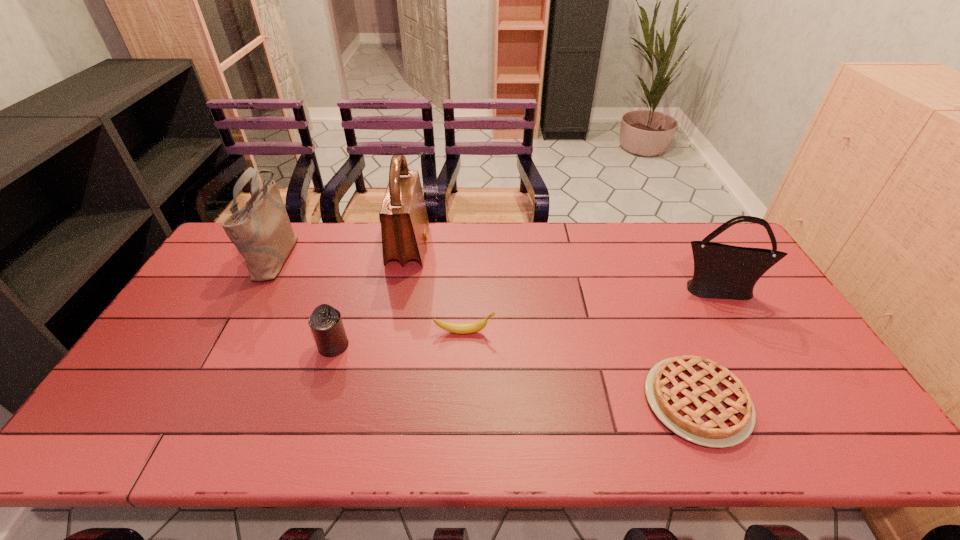
Find the location of a particular element. free space between the pie and the rightmost shoulder bag is located at coordinates (707, 346).

Where is `free point between the fifth object from right to left and the third object from left to right`? The width and height of the screenshot is (960, 540). free point between the fifth object from right to left and the third object from left to right is located at coordinates [372, 296].

Image resolution: width=960 pixels, height=540 pixels. Find the location of `vacant point located between the leftmost object and the second shortest object`. vacant point located between the leftmost object and the second shortest object is located at coordinates (371, 294).

This screenshot has height=540, width=960. I want to click on vacant space that's between the third object from right to left and the shortest shoulder bag, so click(590, 311).

The height and width of the screenshot is (540, 960). Find the location of `vacant space that's between the leftmost object and the third tallest object`. vacant space that's between the leftmost object and the third tallest object is located at coordinates (497, 272).

What are the coordinates of `free space between the fourth object from right to left and the can` in the screenshot? It's located at (372, 296).

Image resolution: width=960 pixels, height=540 pixels. In order to click on object that stands as the fourth closest to the shortest object in this screenshot , I will do `click(325, 322)`.

The height and width of the screenshot is (540, 960). What are the coordinates of `object that is the fifth closest to the third tallest object` in the screenshot? It's located at (261, 230).

Locate which shoulder bag ranks second in proximity to the second shoulder bag from left to right. Please provide its 2D coordinates. Your answer should be formatted as a tuple, i.e. [(x, y)], where the tuple contains the x and y coordinates of a point satisfying the conditions above.

[(721, 271)]

Find the location of `the closest shoulder bag to the fourth object from right to left`. the closest shoulder bag to the fourth object from right to left is located at coordinates (261, 230).